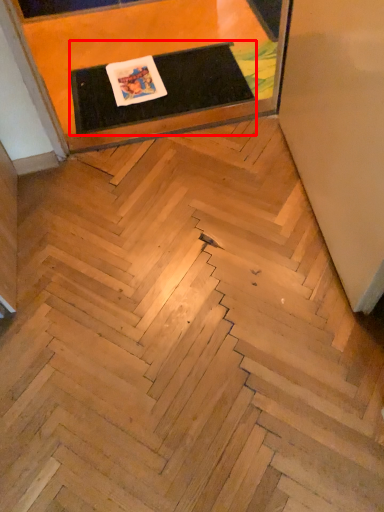
Question: In this image, where is table (annotated by the red box) located relative to furniture?

Choices:
 (A) left
 (B) right

Answer: (B)